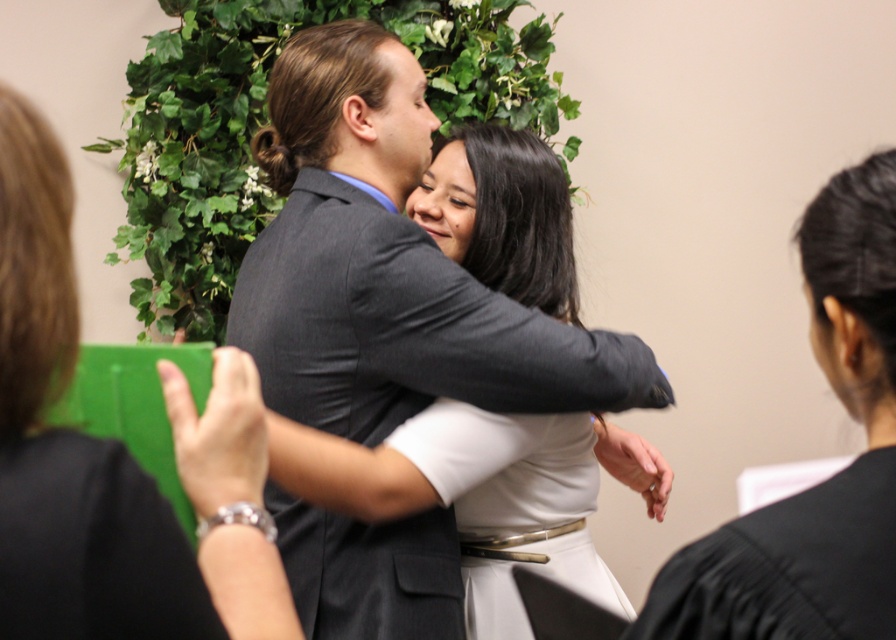
Does dark gray suit at center have a lesser width compared to white satin dress at center?

No, dark gray suit at center is not thinner than white satin dress at center.

Which is more to the left, dark gray suit at center or white satin dress at center?

dark gray suit at center

Which is behind, point (412, 316) or point (466, 582)?

The point (466, 582) is more distant.

This screenshot has height=640, width=896. In order to click on dark gray suit at center in this screenshot , I will do tap(389, 266).

Looking at this image, which of these two, matte black dress at center or white satin dress at center, stands taller?

Standing taller between the two is white satin dress at center.

What do you see at coordinates (91, 458) in the screenshot? The image size is (896, 640). I see `matte black dress at center` at bounding box center [91, 458].

The height and width of the screenshot is (640, 896). What do you see at coordinates (91, 458) in the screenshot?
I see `matte black dress at center` at bounding box center [91, 458].

Where is `matte black dress at center`? matte black dress at center is located at coordinates (91, 458).

Is point (401, 317) less distant than point (222, 566)?

No, it is not.

Is dark gray suit at center below matte black dress at center?

Incorrect, dark gray suit at center is not positioned below matte black dress at center.

Who is more forward, (390,612) or (259,618)?

Point (259,618) is more forward.

Find the location of a particular element. The width and height of the screenshot is (896, 640). dark gray suit at center is located at coordinates (389, 266).